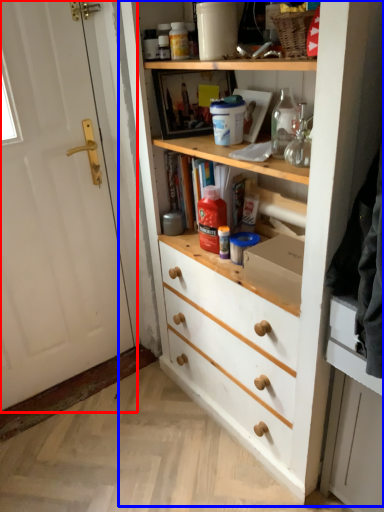
Question: Which object appears closest to the camera in this image, door (highlighted by a red box) or cupboard (highlighted by a blue box)?

Choices:
 (A) door
 (B) cupboard

Answer: (B)